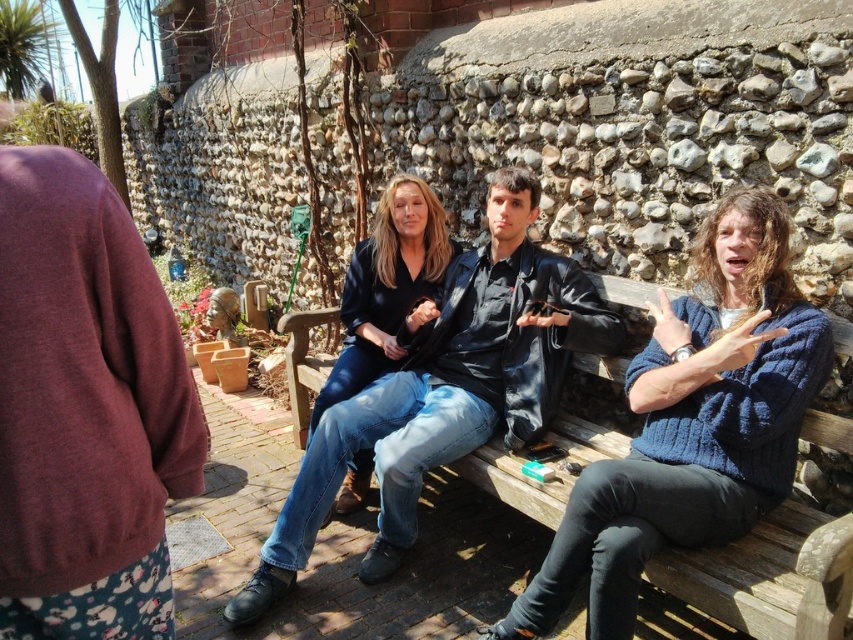
You are a tailor measuring the distance between the knitted blue sweater at center and the denim jeans at center for a custom fitting. Can you confirm if the space between them is more than 70 centimeters?

The distance between the knitted blue sweater at center and the denim jeans at center is 76.33 centimeters, which is more than 70 centimeters.

You are a photographer holding a camera. You want to take a photo of the knitted blue sweater at center. Can you do that from your current position without moving closer or farther away?

The knitted blue sweater at center and camera are 1.98 meters apart from each other. Since the distance is within a typical comfortable range for taking photos, yes, you can take the photo without moving closer or farther away.